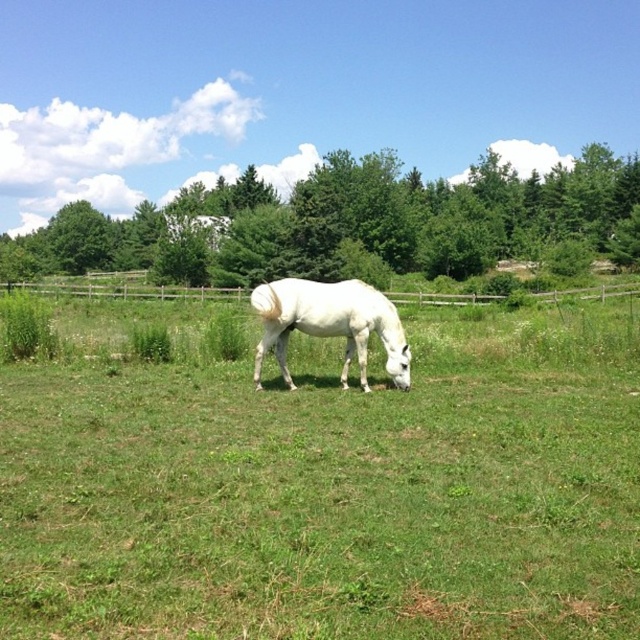
Is white glossy horse at center above wooden fence at center?

Incorrect, white glossy horse at center is not positioned above wooden fence at center.

Where is `white glossy horse at center`? This screenshot has height=640, width=640. white glossy horse at center is located at coordinates (330, 324).

Does green grassy at center appear over white glossy horse at center?

Actually, green grassy at center is below white glossy horse at center.

Can you confirm if green grassy at center is taller than white glossy horse at center?

Indeed, green grassy at center has a greater height compared to white glossy horse at center.

Who is more distant from viewer, (10, 448) or (259, 292)?

The point (259, 292) is behind.

At what (x,y) coordinates should I click in order to perform the action: click on green grassy at center. Please return your answer as a coordinate pair (x, y). Image resolution: width=640 pixels, height=640 pixels. Looking at the image, I should click on (326, 484).

Which of these two, green grassy at center or wooden fence at center, stands taller?

Standing taller between the two is wooden fence at center.

Looking at this image, does green grassy at center have a greater height compared to wooden fence at center?

No.

You are a GUI agent. You are given a task and a screenshot of the screen. Output one action in this format:
    pyautogui.click(x=<x>, y=<y>)
    Task: Click on the green grassy at center
    This screenshot has width=640, height=640.
    Given the screenshot: What is the action you would take?
    pyautogui.click(x=326, y=484)